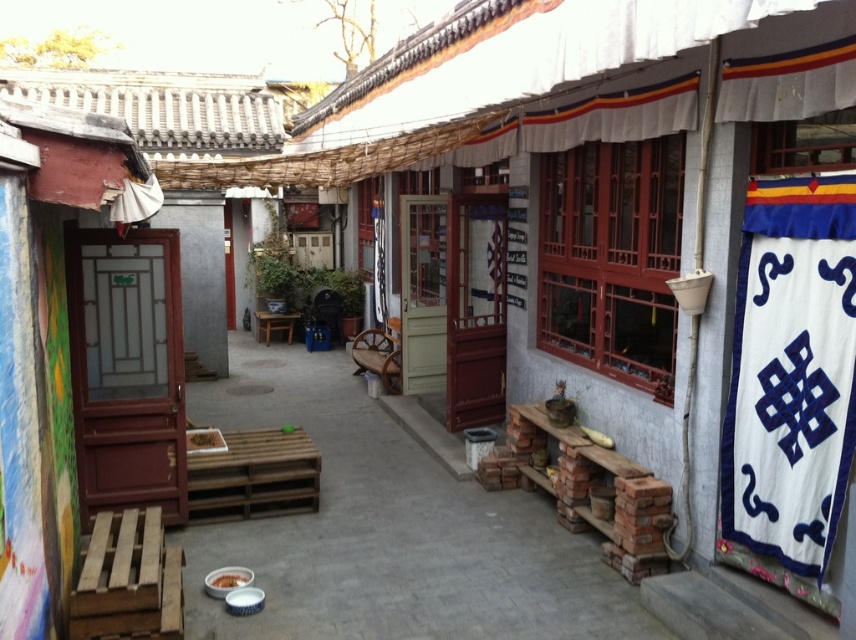
Question: Considering the relative positions of white fabric banner at right and wooden stool at center in the image provided, where is white fabric banner at right located with respect to wooden stool at center?

Choices:
 (A) below
 (B) above

Answer: (A)

Question: Which object appears farthest from the camera in this image?

Choices:
 (A) wooden stool at center
 (B) white fabric banner at right

Answer: (A)

Question: Which point is closer to the camera?

Choices:
 (A) wooden stool at center
 (B) white fabric banner at right

Answer: (B)

Question: Observing the image, what is the correct spatial positioning of white fabric banner at right in reference to wooden stool at center?

Choices:
 (A) above
 (B) below

Answer: (B)

Question: Which object is farther from the camera taking this photo?

Choices:
 (A) white fabric banner at right
 (B) wooden stool at center

Answer: (B)

Question: Does white fabric banner at right have a greater width compared to wooden stool at center?

Choices:
 (A) yes
 (B) no

Answer: (B)